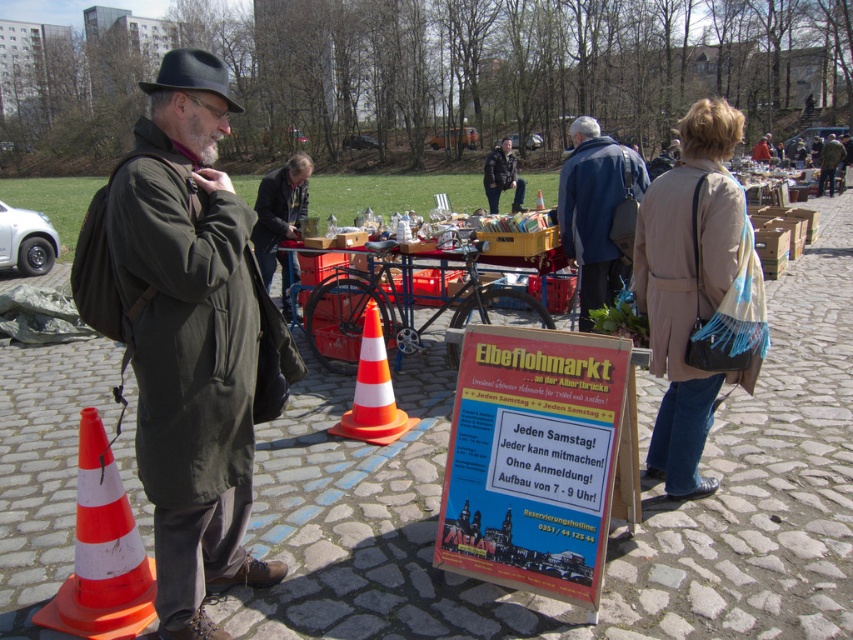
Question: Is orange/white plastic traffic cone at lower left below blue fabric bag at center?

Choices:
 (A) no
 (B) yes

Answer: (B)

Question: Is the position of orange/white plastic traffic cone at center less distant than that of dark brown leather jacket at center?

Choices:
 (A) yes
 (B) no

Answer: (A)

Question: Does blue fabric bag at center have a smaller size compared to dark green coat at center?

Choices:
 (A) yes
 (B) no

Answer: (A)

Question: Which of the following is the closest to the observer?

Choices:
 (A) (270, 241)
 (B) (102, 525)

Answer: (B)

Question: Which point is farther to the camera?

Choices:
 (A) (238, 296)
 (B) (573, 196)
 (C) (265, 214)

Answer: (C)

Question: Among these points, which one is farthest from the camera?

Choices:
 (A) (303, 209)
 (B) (177, 88)
 (C) (125, 588)
 (D) (614, 244)

Answer: (A)